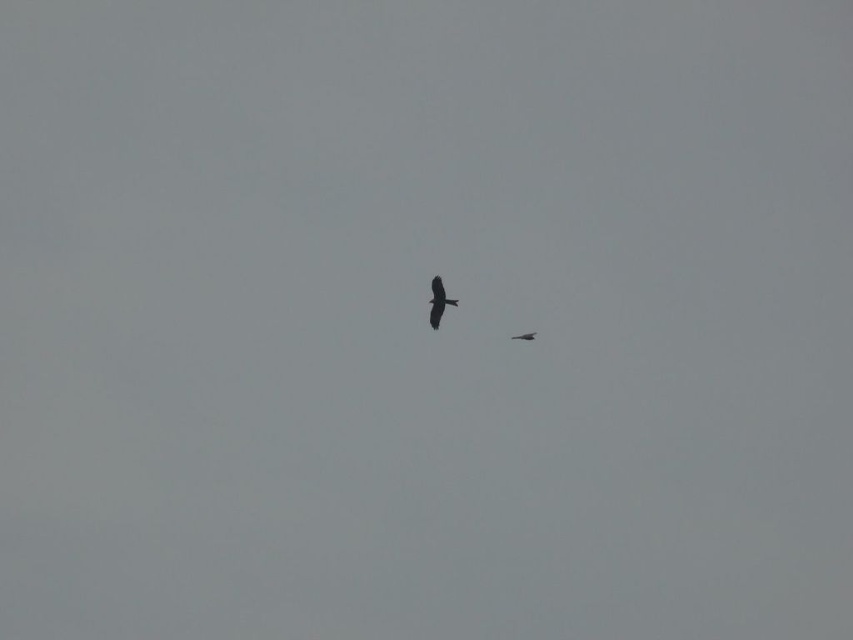
You are a birdwatcher trying to identify two birds flying in the sky. You notice a black matte crow at center and a dark brown feathered bird at center. Which of these two birds has a greater height?

The black matte crow at center is much taller than the dark brown feathered bird at center, so the black matte crow at center has a greater height.

Looking at this image, you are an ornithologist observing two birds in flight against an overcast sky. You notice the black matte crow at center and the dark brown feathered bird at center. Based on their sizes, which bird would likely have a larger wingspan?

The black matte crow at center has a greater width than the dark brown feathered bird at center, so it likely has a larger wingspan.

You are a drone operator trying to capture a photo of the black matte crow at center. The drone has a camera with a 100mm lens that can focus on objects within a 0.5 meter radius. If the crow is currently at coordinates 0.472, 0.515, will the drone be able to focus on it?

The black matte crow at center is located at point (x=438, y=301). Since the drone camera can focus within a 0.5 meter radius, it should be able to focus on the crow as long as the coordinates fall within that range. However, without knowing the exact distance from the drone to the crow, we cannot definitively confirm the focus capability. The answer depends on the actual distance between the drone and the bird.